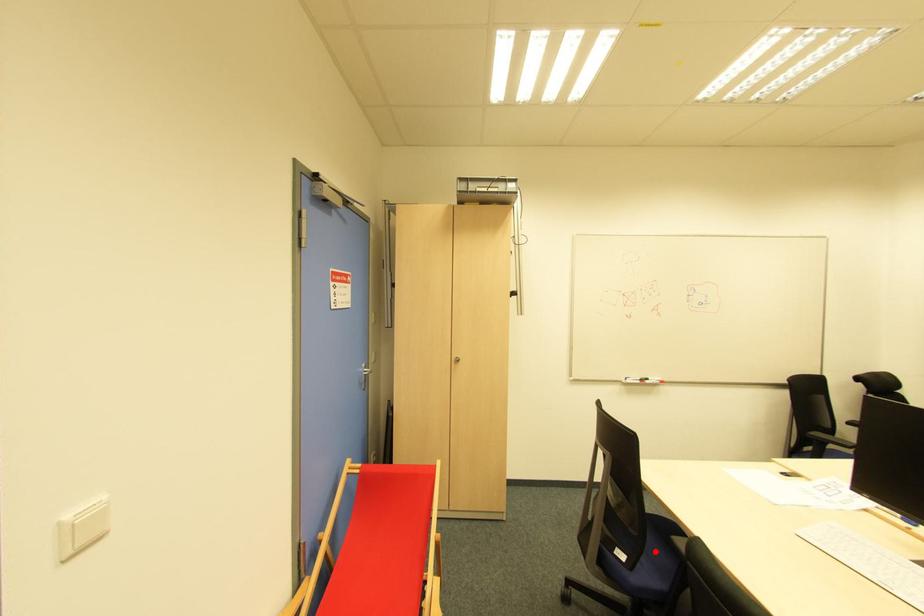
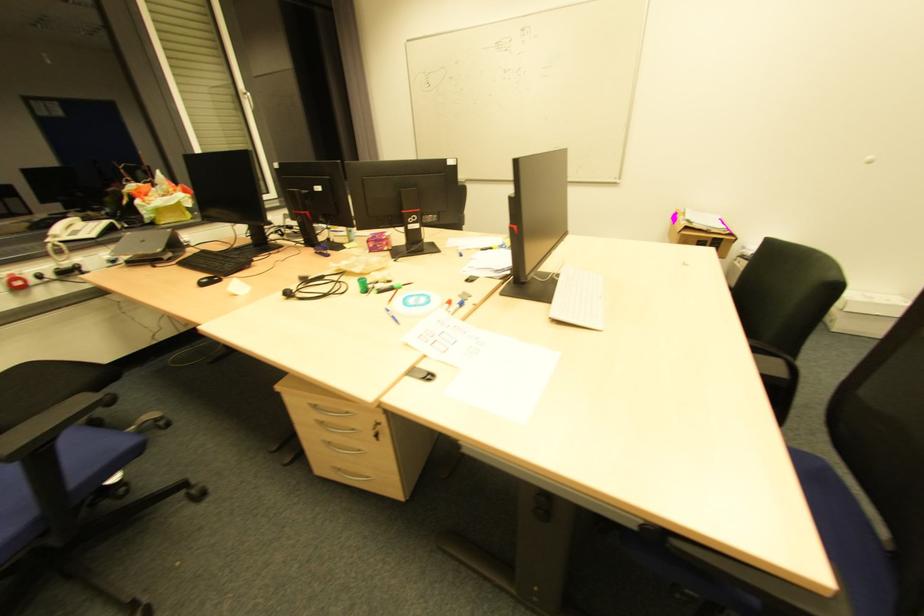
Question: I am providing you with two images of the same scene from different viewpoints. A red point is marked on the first image. Can you still see the location of the red point in image 2?

Choices:
 (A) Yes
 (B) No

Answer: (B)